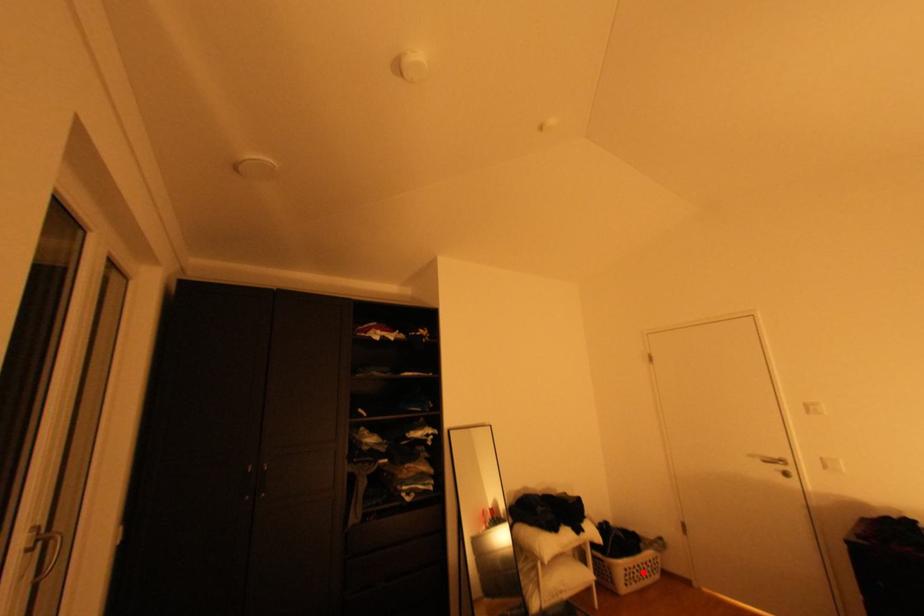
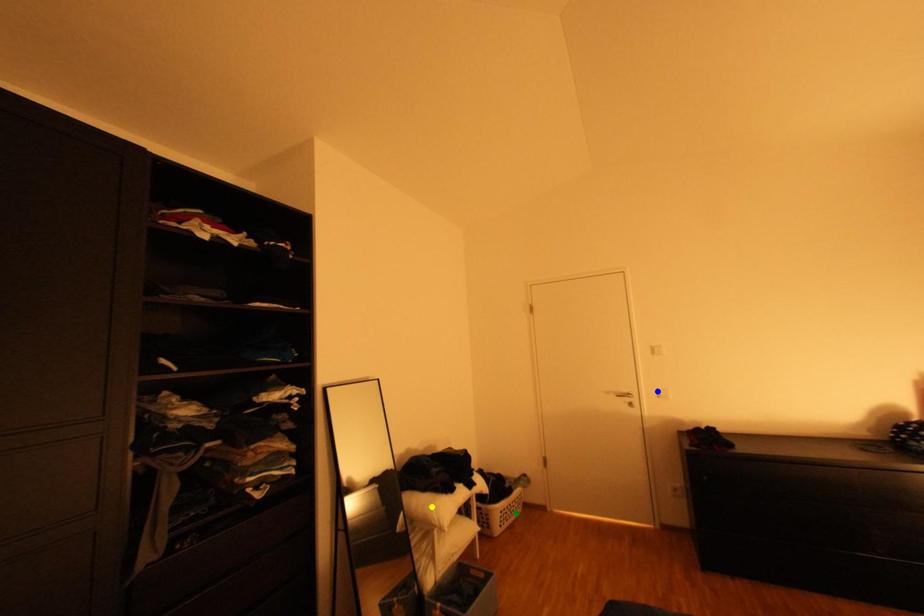
Question: I am providing you with two images of the same scene from different viewpoints. A red point is marked on the first image. You are given multiple points on the second image. Which spot in image 2 lines up with the point in image 1?

Choices:
 (A) yellow point
 (B) green point
 (C) blue point

Answer: (B)